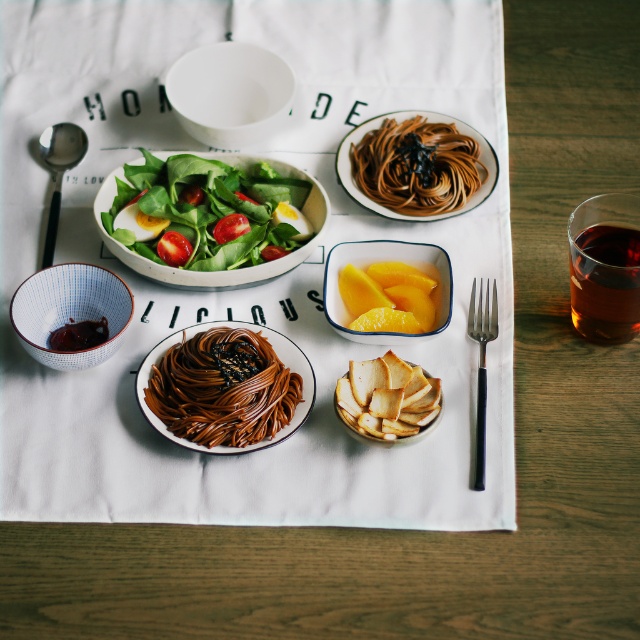
Can you confirm if green leafymaterial/textureobject at upper center is positioned below shiny brown noodles at center?

Incorrect, green leafymaterial/textureobject at upper center is not positioned below shiny brown noodles at center.

Image resolution: width=640 pixels, height=640 pixels. In order to click on green leafymaterial/textureobject at upper center in this screenshot , I will do `click(204, 212)`.

Who is taller, green leafymaterial/textureobject at upper center or blue and white ceramic bowl at lower left?

green leafymaterial/textureobject at upper center

Is green leafymaterial/textureobject at upper center smaller than blue and white ceramic bowl at lower left?

Incorrect, green leafymaterial/textureobject at upper center is not smaller in size than blue and white ceramic bowl at lower left.

Where is `green leafymaterial/textureobject at upper center`? green leafymaterial/textureobject at upper center is located at coordinates (204, 212).

Identify the location of green leafymaterial/textureobject at upper center. The width and height of the screenshot is (640, 640). (204, 212).

Who is more distant from viewer, (353, 179) or (262, 116)?

Positioned behind is point (262, 116).

Locate an element on the screen. brown glossy pasta at center is located at coordinates (417, 164).

Is point (365, 182) farther from camera compared to point (237, 65)?

No, (365, 182) is in front of (237, 65).

The image size is (640, 640). In order to click on brown glossy pasta at center in this screenshot , I will do `click(417, 164)`.